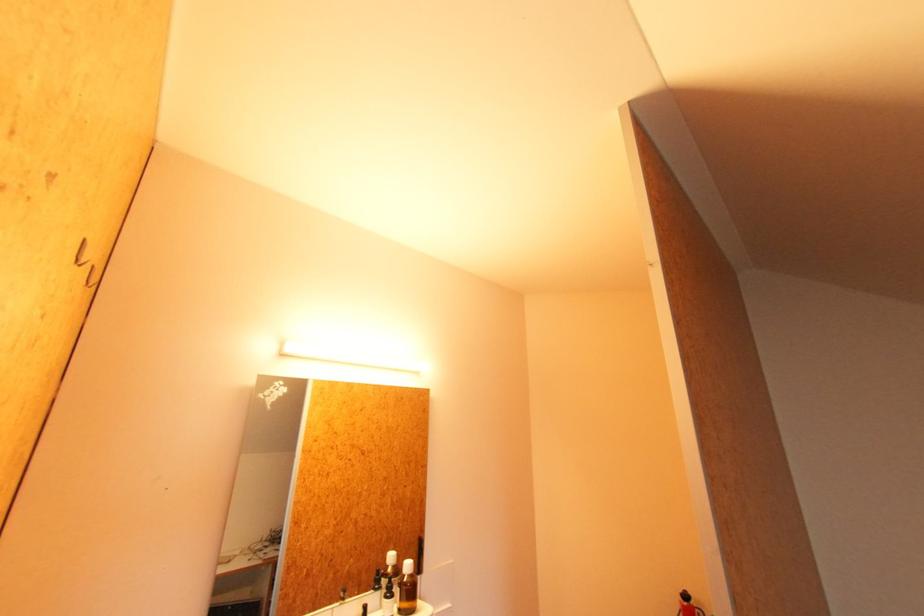
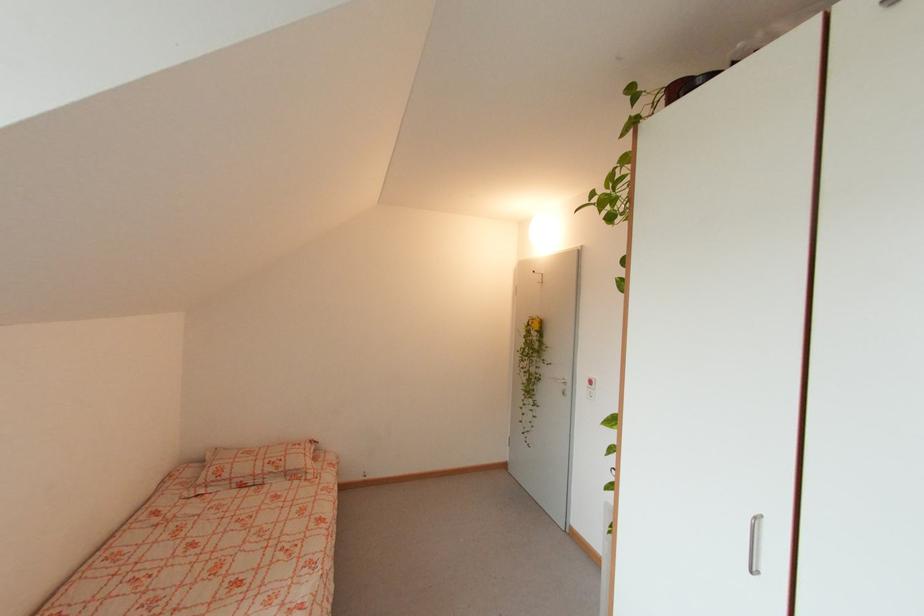
Question: Based on the continuous images, in which direction is the camera rotating? Reply with the corresponding letter.

Choices:
 (A) Left
 (B) Right
 (C) Up
 (D) Down

Answer: (A)